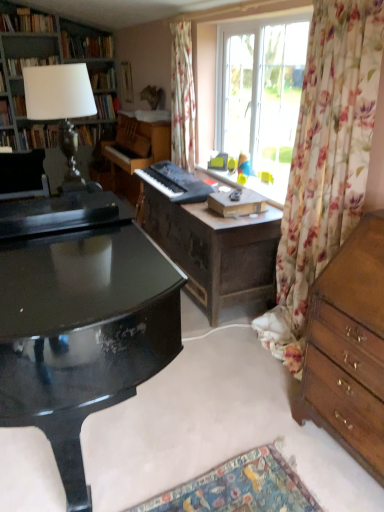
The height and width of the screenshot is (512, 384). What are the coordinates of `blank space to the left of wooden chest of drawers at right` in the screenshot? It's located at (264, 444).